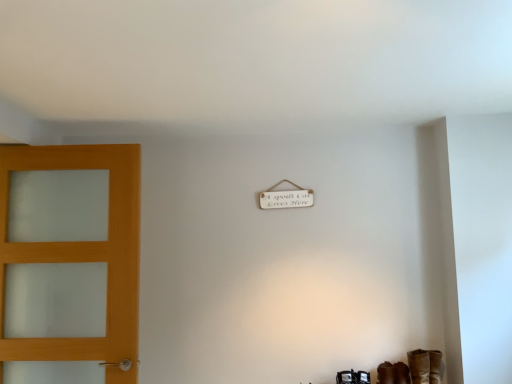
Question: Could you tell me if brown leather boot at lower right is turned towards brown leather shoe at lower right?

Choices:
 (A) no
 (B) yes

Answer: (A)

Question: Considering the relative positions of brown leather boot at lower right and brown leather shoe at lower right in the image provided, is brown leather boot at lower right to the right of brown leather shoe at lower right from the viewer's perspective?

Choices:
 (A) no
 (B) yes

Answer: (B)

Question: Is brown leather boot at lower right behind brown leather shoe at lower right?

Choices:
 (A) no
 (B) yes

Answer: (A)

Question: Is brown leather boot at lower right smaller than brown leather shoe at lower right?

Choices:
 (A) yes
 (B) no

Answer: (B)

Question: Is brown leather boot at lower right positioned with its back to brown leather shoe at lower right?

Choices:
 (A) no
 (B) yes

Answer: (A)

Question: Based on their sizes in the image, would you say brown leather boot at lower right is bigger or smaller than brown leather shoe at lower right?

Choices:
 (A) big
 (B) small

Answer: (A)

Question: Considering the positions of brown leather boot at lower right and brown leather shoe at lower right in the image, is brown leather boot at lower right taller or shorter than brown leather shoe at lower right?

Choices:
 (A) tall
 (B) short

Answer: (A)

Question: Is brown leather boot at lower right wider or thinner than brown leather shoe at lower right?

Choices:
 (A) wide
 (B) thin

Answer: (A)

Question: From a real-world perspective, is brown leather boot at lower right physically located above or below brown leather shoe at lower right?

Choices:
 (A) above
 (B) below

Answer: (A)

Question: From a real-world perspective, relative to matte wood door at left, is brown leather boot at lower right vertically above or below?

Choices:
 (A) below
 (B) above

Answer: (A)

Question: From their relative heights in the image, would you say brown leather boot at lower right is taller or shorter than matte wood door at left?

Choices:
 (A) tall
 (B) short

Answer: (B)

Question: In terms of size, does brown leather boot at lower right appear bigger or smaller than matte wood door at left?

Choices:
 (A) small
 (B) big

Answer: (A)

Question: In the image, is brown leather boot at lower right on the left side or the right side of matte wood door at left?

Choices:
 (A) left
 (B) right

Answer: (B)

Question: From the image's perspective, relative to brown leather shoe at lower right, is matte wood door at left above or below?

Choices:
 (A) below
 (B) above

Answer: (B)

Question: In terms of size, does matte wood door at left appear bigger or smaller than brown leather shoe at lower right?

Choices:
 (A) small
 (B) big

Answer: (B)